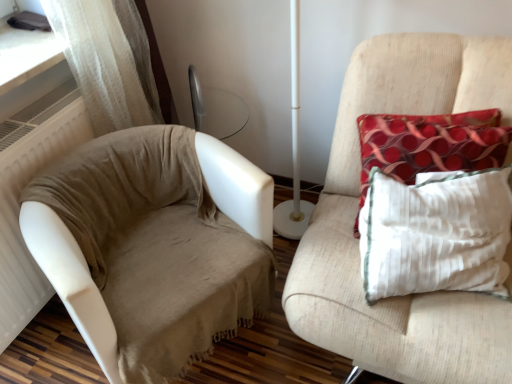
Question: From a real-world perspective, is beige fabric couch at left below red dotted fabric pillow at right?

Choices:
 (A) no
 (B) yes

Answer: (B)

Question: Can you confirm if beige fabric couch at left is thinner than red dotted fabric pillow at right?

Choices:
 (A) yes
 (B) no

Answer: (B)

Question: From the image's perspective, is beige fabric couch at left beneath red dotted fabric pillow at right?

Choices:
 (A) yes
 (B) no

Answer: (A)

Question: From a real-world perspective, is beige fabric couch at left physically above red dotted fabric pillow at right?

Choices:
 (A) no
 (B) yes

Answer: (A)

Question: Is beige fabric couch at left to the left of red dotted fabric pillow at right from the viewer's perspective?

Choices:
 (A) yes
 (B) no

Answer: (A)

Question: From their relative heights in the image, would you say textured beige armchair at right is taller or shorter than beige fabric couch at left?

Choices:
 (A) tall
 (B) short

Answer: (A)

Question: Does point (316, 337) appear closer or farther from the camera than point (159, 364)?

Choices:
 (A) closer
 (B) farther

Answer: (A)

Question: Based on their sizes in the image, would you say textured beige armchair at right is bigger or smaller than beige fabric couch at left?

Choices:
 (A) big
 (B) small

Answer: (A)

Question: In the image, is textured beige armchair at right positioned in front of or behind beige fabric couch at left?

Choices:
 (A) front
 (B) behind

Answer: (A)

Question: Does point tap(475, 109) appear closer or farther from the camera than point tap(399, 170)?

Choices:
 (A) farther
 (B) closer

Answer: (A)

Question: In terms of size, does textured beige armchair at right appear bigger or smaller than red dotted fabric pillow at right?

Choices:
 (A) small
 (B) big

Answer: (B)

Question: From the image's perspective, relative to red dotted fabric pillow at right, is textured beige armchair at right above or below?

Choices:
 (A) below
 (B) above

Answer: (A)

Question: Considering the positions of textured beige armchair at right and red dotted fabric pillow at right in the image, is textured beige armchair at right taller or shorter than red dotted fabric pillow at right?

Choices:
 (A) tall
 (B) short

Answer: (A)

Question: Is point (219, 331) positioned closer to the camera than point (390, 134)?

Choices:
 (A) farther
 (B) closer

Answer: (A)

Question: Considering the positions of beige fabric couch at left and red dotted fabric pillow at right in the image, is beige fabric couch at left bigger or smaller than red dotted fabric pillow at right?

Choices:
 (A) small
 (B) big

Answer: (B)